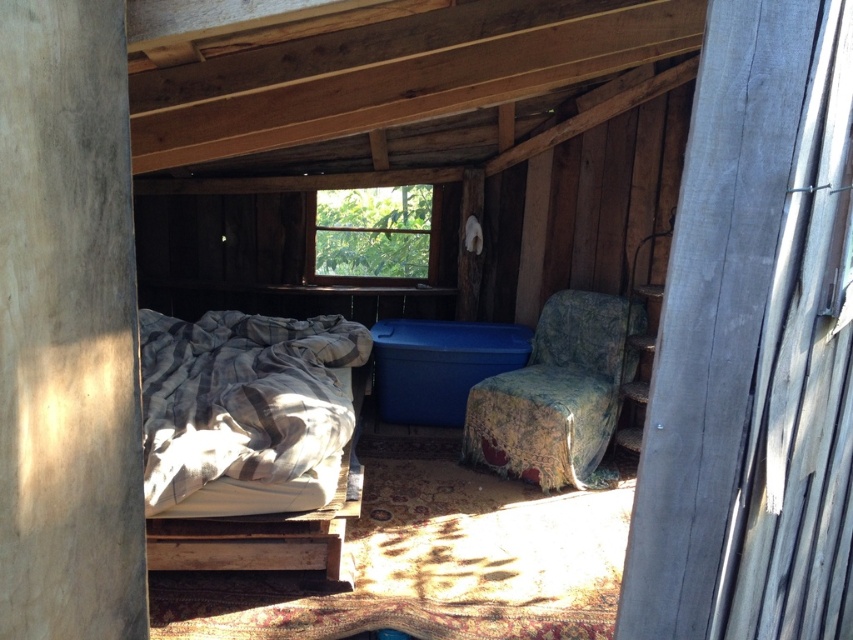
Question: Which of the following is the farthest from the observer?

Choices:
 (A) [x=613, y=365]
 (B) [x=166, y=506]

Answer: (A)

Question: Can you confirm if plaid fabric bed at left is positioned to the left of worn fabric armchair at center-right?

Choices:
 (A) no
 (B) yes

Answer: (B)

Question: Can you confirm if plaid fabric bed at left is positioned above worn fabric armchair at center-right?

Choices:
 (A) yes
 (B) no

Answer: (B)

Question: Which point appears farthest from the camera in this image?

Choices:
 (A) (283, 481)
 (B) (486, 436)

Answer: (B)

Question: Considering the relative positions of plaid fabric bed at left and worn fabric armchair at center-right in the image provided, where is plaid fabric bed at left located with respect to worn fabric armchair at center-right?

Choices:
 (A) right
 (B) left

Answer: (B)